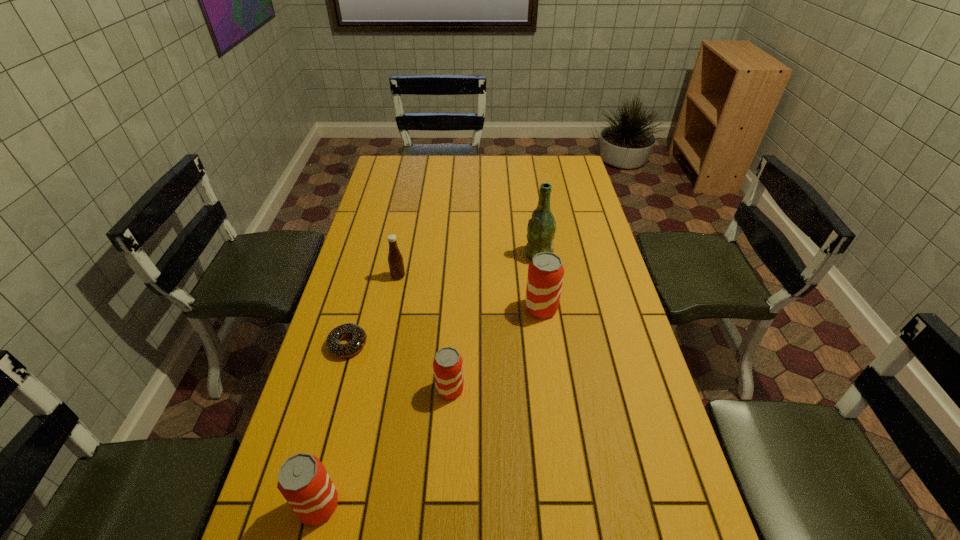
At what (x,y) coordinates should I click in order to perform the action: click on the third closest object to the third object from right to left. Please return your answer as a coordinate pair (x, y). Looking at the image, I should click on (303, 480).

Point out which beer can is positioned as the second nearest to the rightmost beer can. Please provide its 2D coordinates. Your answer should be formatted as a tuple, i.e. [(x, y)], where the tuple contains the x and y coordinates of a point satisfying the conditions above.

[(303, 480)]

Select which beer can appears as the second closest to the third farthest object. Please provide its 2D coordinates. Your answer should be formatted as a tuple, i.e. [(x, y)], where the tuple contains the x and y coordinates of a point satisfying the conditions above.

[(303, 480)]

The height and width of the screenshot is (540, 960). I want to click on free point that satisfies the following two spatial constraints: 1. on the front side of the second farthest object; 2. on the right side of the fifth tallest object, so click(375, 389).

Identify the location of vacant space that satisfies the following two spatial constraints: 1. on the surface of the tallest object; 2. on the front side of the third object from left to right. (541, 276).

Find the location of a particular element. The width and height of the screenshot is (960, 540). free space that satisfies the following two spatial constraints: 1. on the back side of the nearest beer can; 2. on the right side of the third object from left to right is located at coordinates (376, 276).

Locate an element on the screen. vacant position in the image that satisfies the following two spatial constraints: 1. on the surface of the farthest object; 2. on the front side of the second beer can from left to right is located at coordinates 559,389.

Locate an element on the screen. The image size is (960, 540). vacant area in the image that satisfies the following two spatial constraints: 1. on the back side of the fifth nearest object; 2. on the left side of the nearest object is located at coordinates (376, 276).

I want to click on free space that satisfies the following two spatial constraints: 1. on the surface of the farthest object; 2. on the front side of the nearest beer can, so click(x=576, y=505).